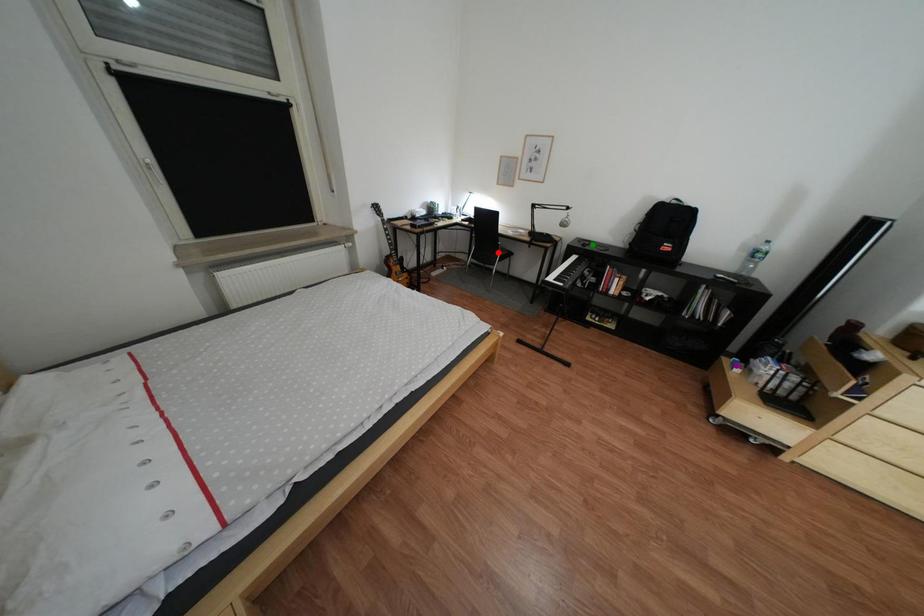
Order these from nearest to farthest:
green point, red point, purple point

purple point
green point
red point